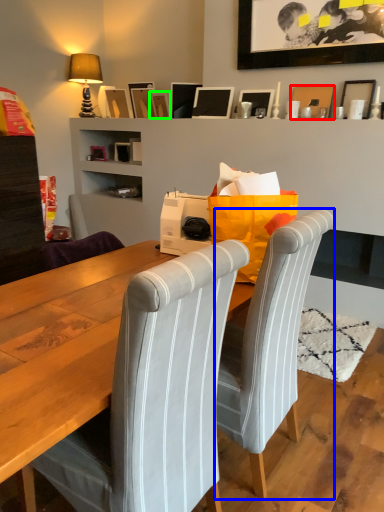
Question: Estimate the real-world distances between objects in this image. Which object is farther from picture frame (highlighted by a red box), chair (highlighted by a blue box) or picture frame (highlighted by a green box)?

Choices:
 (A) chair
 (B) picture frame

Answer: (A)